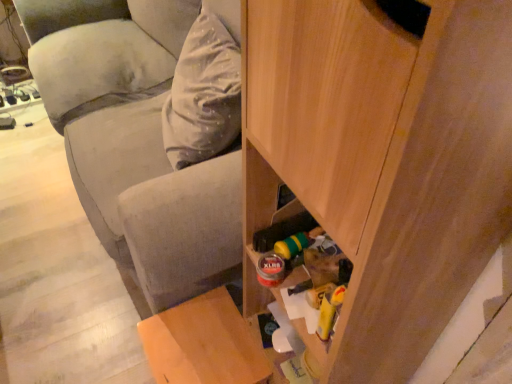
Find the location of a particular element. free space above wooden stool at lower left (from a real-world perspective) is located at coordinates (201, 340).